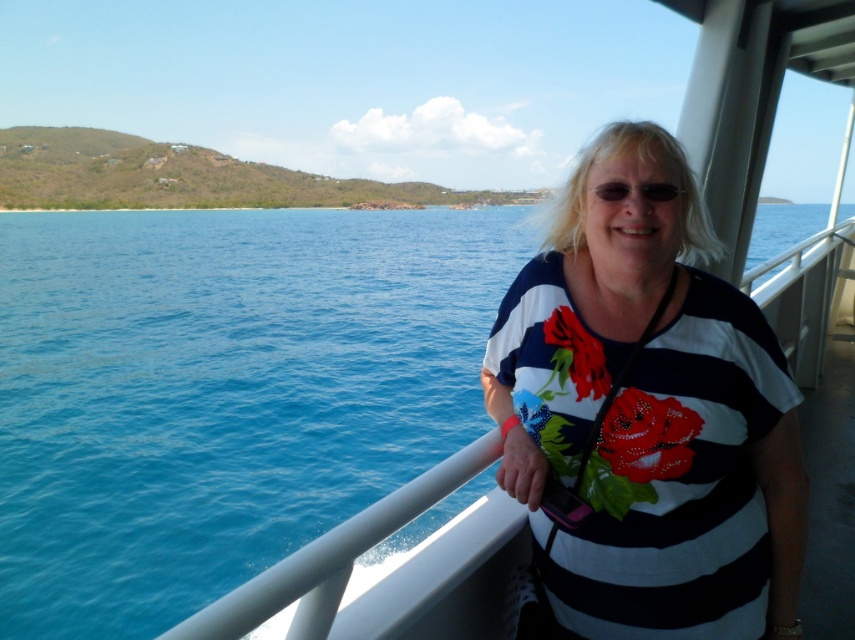
Measure the distance between striped fabric shirt at center and black plastic sunglasses at center.

striped fabric shirt at center and black plastic sunglasses at center are 21.53 inches apart from each other.

Is striped fabric shirt at center bigger than black plastic sunglasses at center?

Yes.

Is point (634, 600) farther from viewer compared to point (618, 189)?

Yes, it is.

The width and height of the screenshot is (855, 640). Find the location of `striped fabric shirt at center`. striped fabric shirt at center is located at coordinates (647, 416).

Does blue water at center have a smaller size compared to striped fabric shirt at center?

No.

Is blue water at center below striped fabric shirt at center?

No, blue water at center is not below striped fabric shirt at center.

Is point (3, 348) closer to viewer compared to point (794, 564)?

No, (3, 348) is further to viewer.

Where is `blue water at center`? The width and height of the screenshot is (855, 640). blue water at center is located at coordinates (220, 392).

Is blue water at center wider than black plastic sunglasses at center?

Yes.

Who is positioned more to the left, blue water at center or black plastic sunglasses at center?

blue water at center

Is point (289, 365) closer to viewer compared to point (614, 180)?

That is False.

You are a GUI agent. You are given a task and a screenshot of the screen. Output one action in this format:
    pyautogui.click(x=<x>, y=<y>)
    Task: Click on the blue water at center
    The image size is (855, 640).
    Given the screenshot: What is the action you would take?
    pyautogui.click(x=220, y=392)